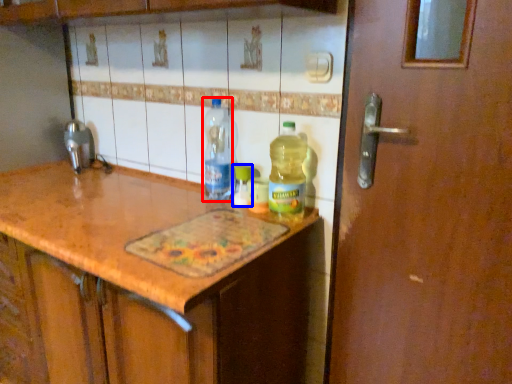
Question: Which object is further to the camera taking this photo, bottle (highlighted by a red box) or bottle (highlighted by a blue box)?

Choices:
 (A) bottle
 (B) bottle

Answer: (B)